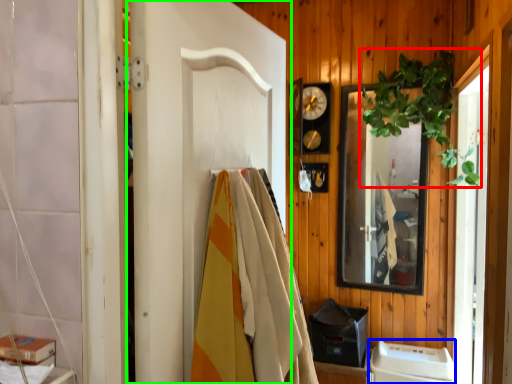
Question: Based on their relative distances, which object is nearer to plant (highlighted by a red box)? Choose from appliance (highlighted by a blue box) and door (highlighted by a green box).

Choices:
 (A) appliance
 (B) door

Answer: (A)